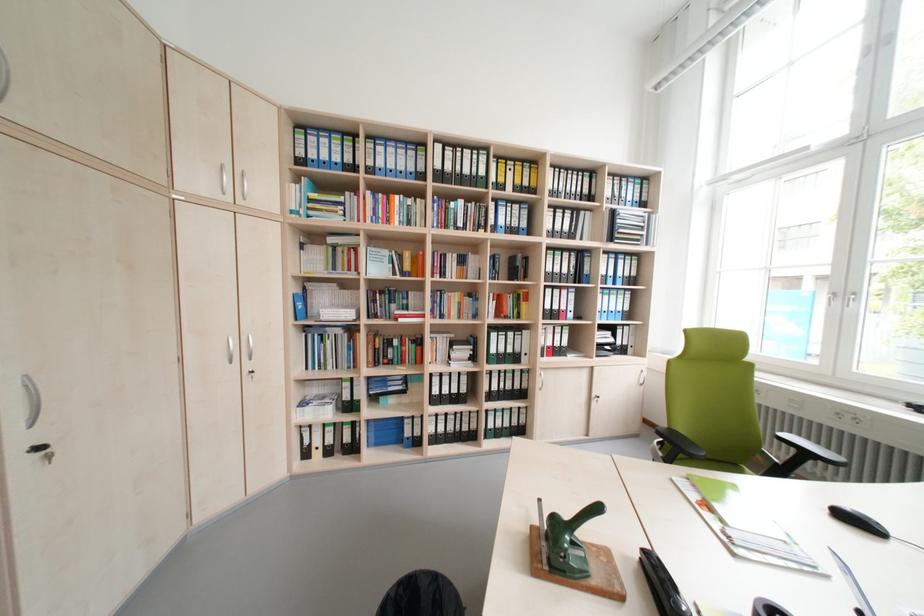
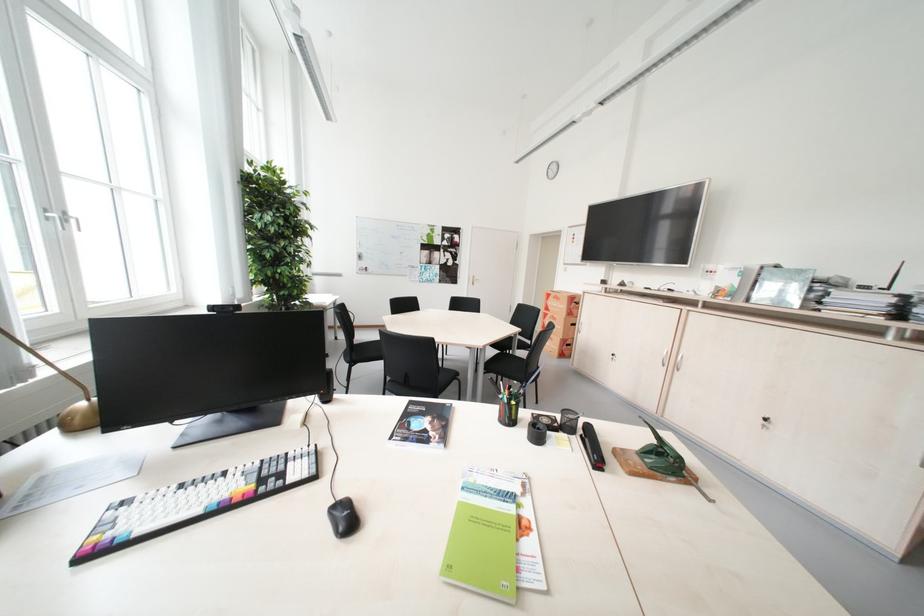
Where in the second image is the point corresponding to (x=864, y=522) from the first image?

(359, 521)